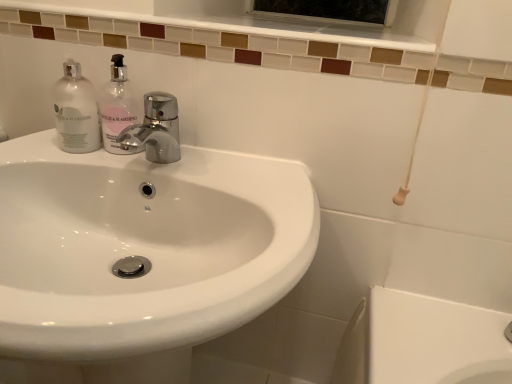
Question: Does clear glass bottle at left come in front of white glossy sink at center?

Choices:
 (A) no
 (B) yes

Answer: (A)

Question: Is clear glass bottle at left taller than white glossy sink at center?

Choices:
 (A) yes
 (B) no

Answer: (B)

Question: Is clear glass bottle at left positioned with its back to white glossy sink at center?

Choices:
 (A) no
 (B) yes

Answer: (A)

Question: Can you confirm if clear glass bottle at left is wider than white glossy sink at center?

Choices:
 (A) yes
 (B) no

Answer: (B)

Question: From a real-world perspective, is clear glass bottle at left positioned under white glossy sink at center based on gravity?

Choices:
 (A) yes
 (B) no

Answer: (B)

Question: In the image, is clear glass bottle at left positioned in front of or behind translucent glass soap dispenser at upper left?

Choices:
 (A) behind
 (B) front

Answer: (A)

Question: In terms of height, does clear glass bottle at left look taller or shorter compared to translucent glass soap dispenser at upper left?

Choices:
 (A) tall
 (B) short

Answer: (B)

Question: In terms of size, does clear glass bottle at left appear bigger or smaller than translucent glass soap dispenser at upper left?

Choices:
 (A) big
 (B) small

Answer: (A)

Question: From a real-world perspective, is clear glass bottle at left physically located above or below translucent glass soap dispenser at upper left?

Choices:
 (A) below
 (B) above

Answer: (A)

Question: Which is correct: white glossy sink at center is inside translucent glass soap dispenser at upper left, or outside of it?

Choices:
 (A) outside
 (B) inside

Answer: (A)

Question: Considering the positions of white glossy sink at center and translucent glass soap dispenser at upper left in the image, is white glossy sink at center wider or thinner than translucent glass soap dispenser at upper left?

Choices:
 (A) thin
 (B) wide

Answer: (B)

Question: From a real-world perspective, is white glossy sink at center above or below translucent glass soap dispenser at upper left?

Choices:
 (A) above
 (B) below

Answer: (B)

Question: From the image's perspective, is white glossy sink at center located above or below translucent glass soap dispenser at upper left?

Choices:
 (A) below
 (B) above

Answer: (A)

Question: Based on their sizes in the image, would you say clear glass bottle at left is bigger or smaller than white glossy sink at center?

Choices:
 (A) big
 (B) small

Answer: (B)

Question: From a real-world perspective, is clear glass bottle at left above or below white glossy sink at center?

Choices:
 (A) above
 (B) below

Answer: (A)